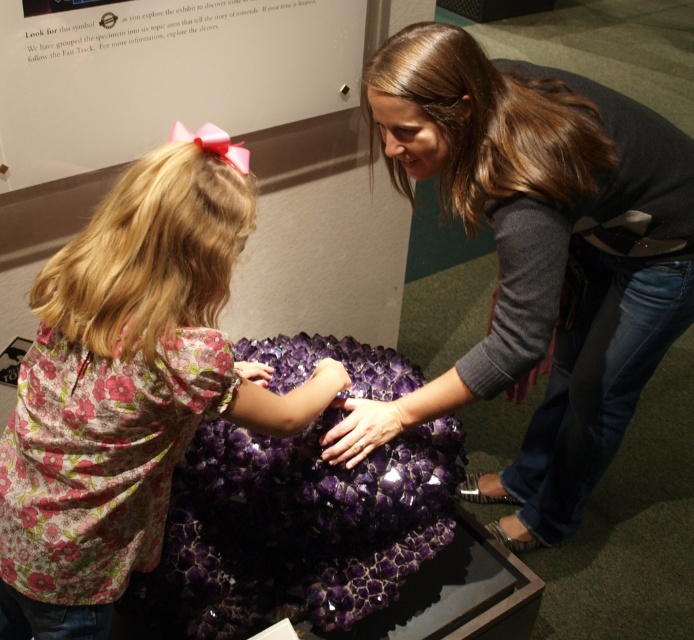
You are a photographer standing 1.5 meters away from the glass case containing the purple crystal formation. You want to take a photo of the point at coordinates point (555, 108). Will you need to move closer or farther away to ensure this point is in focus?

The distance of point (555, 108) from camera is 1.30 meters. Since you are currently 1.5 meters away, you need to move 0.2 meters closer to reach the required distance of 1.30 meters for the point to be in focus.

You are a museum security guard who needs to ensure the floral fabric shirt at lower left and the matte purple rock at center are not too close to each other. According to the museum policy, the distance between any visitor and the exhibit must be at least 1 meter. Can you confirm if the current spacing meets this requirement?

The matte purple rock at center is wider than the floral fabric shirt at lower left, but the Objects Description only provides information about their sizes, not their distance. Therefore, I cannot confirm if the required distance is maintained based on the given information.

You are an art curator planning to rearrange the exhibit layout. The matte purple rock at center and the floral fabric shirt at lower left are part of the display. To ensure proper spacing between them, you need to know their relative positions. Which object is located to the right of the other?

The matte purple rock at center is positioned on the right side of the floral fabric shirt at lower left, meaning the matte purple rock at center is to the right of the floral fabric shirt at lower left.